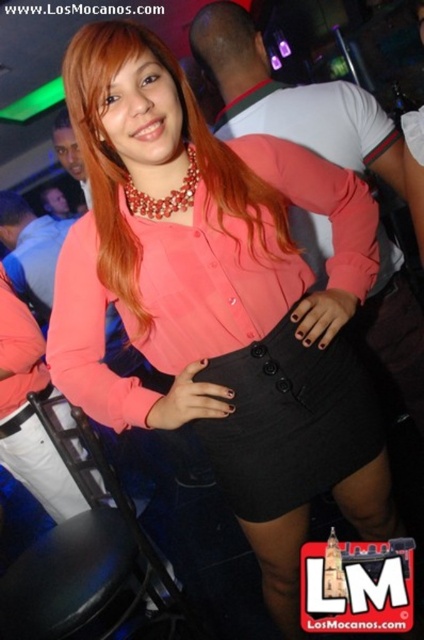
What is located at the point with coordinates (127, 170) in the image?

The point (127, 170) corresponds to the blonde silky hair at center.

You are a photographer at the event and want to focus on the black textured skirt at center and the blonde silky hair at center. Which object is closer to your camera lens?

The black textured skirt at center is closer to the camera lens because it is further to the viewer than the blonde silky hair at center.

You are taking a photo at a party and want to focus on both the woman in the center and an object in the background. You notice two points marked as point 1 at coordinates point (256, 422) and point 2 at coordinates point (136, 193). Which point should you adjust your camera focus to ensure both are in focus?

To ensure both point (256, 422) and point (136, 193) are in focus, you should focus on the point that is between them. Since point (256, 422) is further to the camera than point (136, 193), the optimal focus point would be closer to the closer point (136, 193) to maximize depth of field coverage for both subjects.